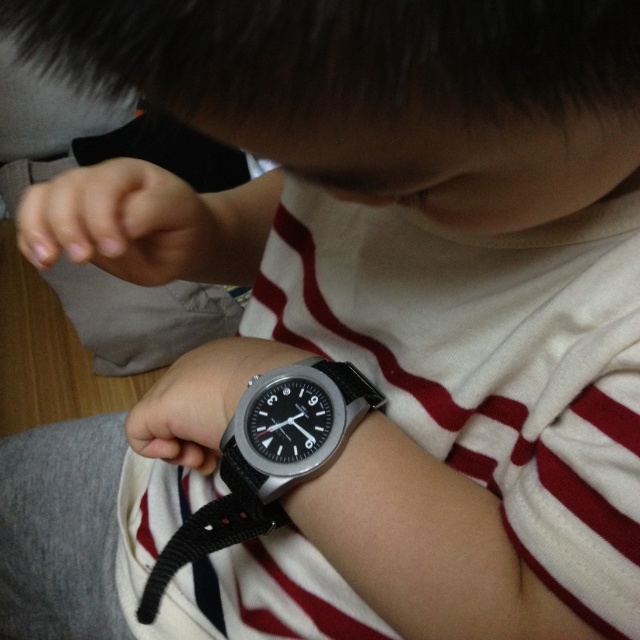
Question: Does matte skin hand at lower left come behind black rubber watch at center?

Choices:
 (A) no
 (B) yes

Answer: (B)

Question: Does black nylon strap at wrist appear under black rubber watch at center?

Choices:
 (A) yes
 (B) no

Answer: (A)

Question: Among these objects, which one is farthest from the camera?

Choices:
 (A) black rubber watch at lower center
 (B) black nylon strap at wrist

Answer: (A)

Question: Which object is positioned farthest from the black nylon strap at wrist?

Choices:
 (A) black rubber watch at center
 (B) matte skin hand at lower left
 (C) black rubber watch at lower center

Answer: (B)

Question: Which object is closer to the camera taking this photo?

Choices:
 (A) black rubber watch at lower center
 (B) black nylon strap at wrist

Answer: (B)

Question: Is the position of matte skin hand at lower left more distant than that of black rubber watch at center?

Choices:
 (A) yes
 (B) no

Answer: (A)